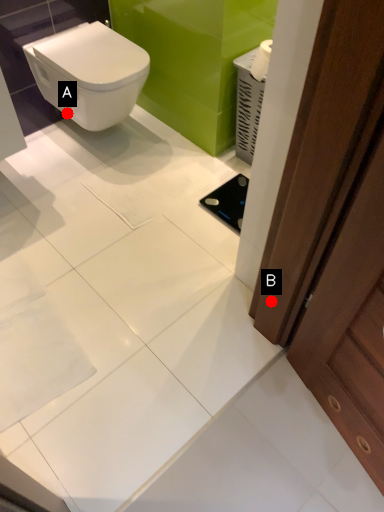
Question: Two points are circled on the image, labeled by A and B beside each circle. Among these points, which one is farthest from the camera?

Choices:
 (A) A is further
 (B) B is further

Answer: (A)